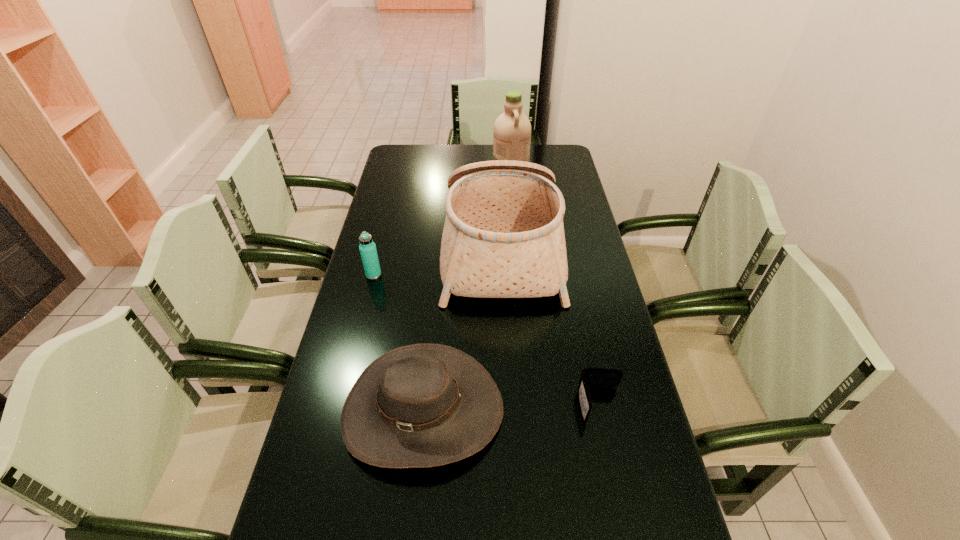
Identify the location of free point located 0.240m on the front label of the farthest object. This screenshot has height=540, width=960. (438, 161).

Where is `vacant space positioned on the back of the water bottle`? vacant space positioned on the back of the water bottle is located at coordinates (377, 259).

Where is `blank space located on the front-facing side of the cowboy hat`? The image size is (960, 540). blank space located on the front-facing side of the cowboy hat is located at coordinates (413, 508).

Identify the location of vacant space situated 0.230m on the outer surface of the shortest object. Image resolution: width=960 pixels, height=540 pixels. (628, 532).

This screenshot has height=540, width=960. Find the location of `object that is at the far edge`. object that is at the far edge is located at coordinates (512, 130).

The width and height of the screenshot is (960, 540). What are the coordinates of `water bottle positioned at the left edge` in the screenshot? It's located at (367, 247).

Locate an element on the screen. This screenshot has width=960, height=540. cowboy hat located at the left edge is located at coordinates (424, 405).

Locate an element on the screen. basket that is positioned at the right edge is located at coordinates (503, 237).

The height and width of the screenshot is (540, 960). What are the coordinates of `wallet that is at the right edge` in the screenshot? It's located at (590, 377).

Locate an element on the screen. This screenshot has height=540, width=960. vacant space at the left edge of the desktop is located at coordinates (404, 214).